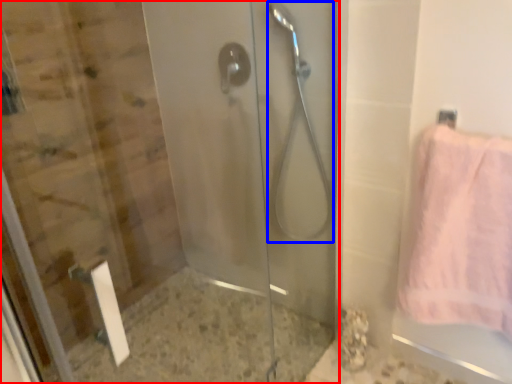
Question: Which of the following is the farthest to the observer, screen door (highlighted by a red box) or shower (highlighted by a blue box)?

Choices:
 (A) screen door
 (B) shower

Answer: (B)